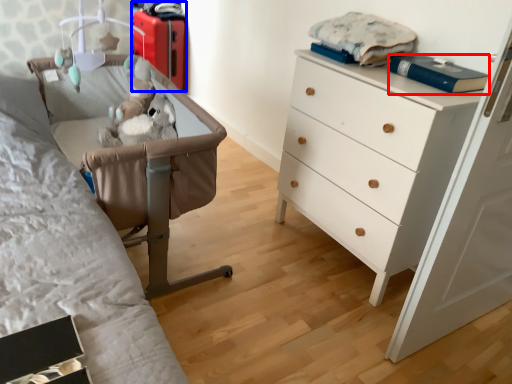
Question: Which of the following is the farthest to the observer, book (highlighted by a red box) or luggage (highlighted by a blue box)?

Choices:
 (A) book
 (B) luggage

Answer: (B)